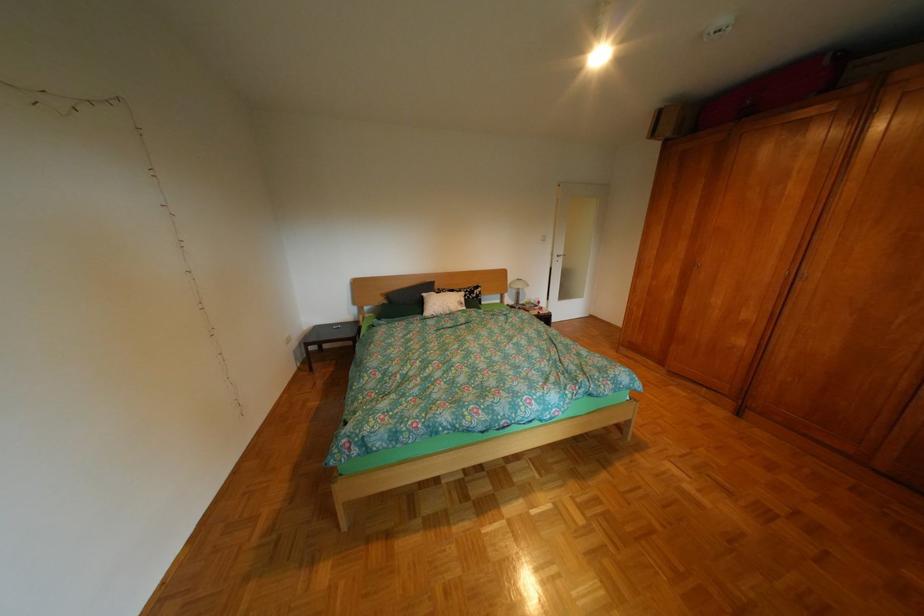
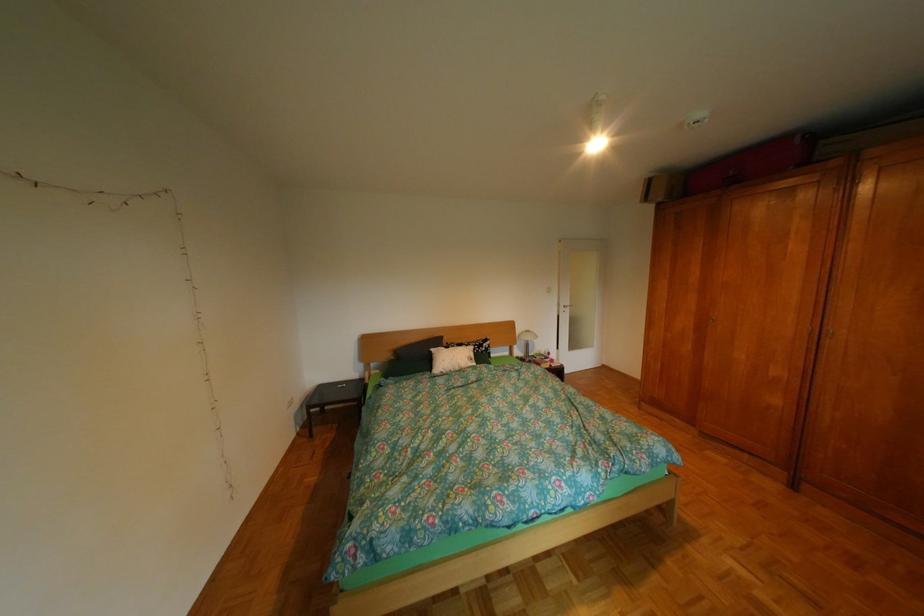
Question: Which direction would the cameraman need to move to produce the second image? Reply with the corresponding letter.

Choices:
 (A) Left
 (B) Right
 (C) Forward
 (D) Backward

Answer: (A)